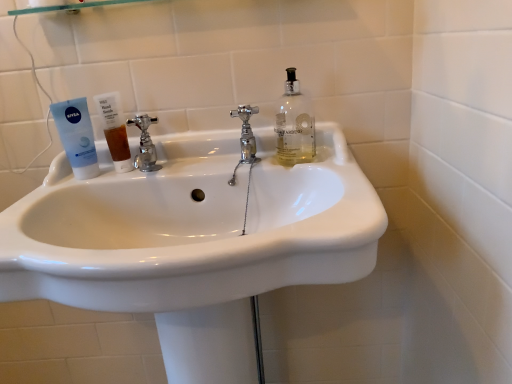
Measure the distance between point [80,239] and camera.

The distance of point [80,239] from camera is 30.91 inches.

Locate an element on the screen. The image size is (512, 384). polished chrome faucet at center, the 2th tap in the right-to-left sequence is located at coordinates (145, 144).

What do you see at coordinates (118, 143) in the screenshot?
I see `brown translucent liquid at sink left` at bounding box center [118, 143].

Locate an element on the screen. The height and width of the screenshot is (384, 512). brown translucent liquid at sink left is located at coordinates (118, 143).

What is the approximate width of polished chrome faucet at center, acting as the 2th tap starting from the left?

polished chrome faucet at center, acting as the 2th tap starting from the left, is 2.17 inches in width.

Locate an element on the screen. The width and height of the screenshot is (512, 384). blue matte tube at left is located at coordinates (77, 136).

Where is `white glossy sink at center`? This screenshot has height=384, width=512. white glossy sink at center is located at coordinates (194, 241).

How much distance is there between polished chrome faucet at center, the 2th tap in the right-to-left sequence, and blue matte tube at left?

polished chrome faucet at center, the 2th tap in the right-to-left sequence, is 10.37 centimeters from blue matte tube at left.

In the scene shown: From the image's perspective, is polished chrome faucet at center, the first tap from the left, over blue matte tube at left?

Yes, from the image's perspective, polished chrome faucet at center, the first tap from the left, is over blue matte tube at left.

Is the surface of polished chrome faucet at center, the first tap from the left, in direct contact with blue matte tube at left?

No, polished chrome faucet at center, the first tap from the left, is not making contact with blue matte tube at left.

Considering the sizes of objects polished chrome faucet at center, the 2th tap in the right-to-left sequence, and blue matte tube at left in the image provided, who is smaller, polished chrome faucet at center, the 2th tap in the right-to-left sequence, or blue matte tube at left?

With smaller size is polished chrome faucet at center, the 2th tap in the right-to-left sequence.

Does blue matte tube at left have a greater width compared to polished chrome faucet at center, arranged as the 1th tap when viewed from the right?

Indeed, blue matte tube at left has a greater width compared to polished chrome faucet at center, arranged as the 1th tap when viewed from the right.

Who is taller, blue matte tube at left or polished chrome faucet at center, acting as the 2th tap starting from the left?

blue matte tube at left.

From the image's perspective, who appears lower, blue matte tube at left or polished chrome faucet at center, acting as the 2th tap starting from the left?

blue matte tube at left.

Which is behind, point (88, 157) or point (249, 135)?

The point (249, 135) is more distant.

From the image's perspective, which one is positioned lower, polished chrome faucet at center, acting as the 2th tap starting from the left, or brown translucent liquid at sink left?

From the image's view, brown translucent liquid at sink left is below.

Does polished chrome faucet at center, acting as the 2th tap starting from the left, have a greater width compared to brown translucent liquid at sink left?

Yes.

Does polished chrome faucet at center, arranged as the 1th tap when viewed from the right, have a greater height compared to brown translucent liquid at sink left?

Yes, polished chrome faucet at center, arranged as the 1th tap when viewed from the right, is taller than brown translucent liquid at sink left.

Is point (129, 154) behind point (145, 170)?

Yes, it is.

Considering the positions of objects brown translucent liquid at sink left and polished chrome faucet at center, the 2th tap in the right-to-left sequence, in the image provided, who is behind, brown translucent liquid at sink left or polished chrome faucet at center, the 2th tap in the right-to-left sequence,?

Positioned behind is brown translucent liquid at sink left.

Considering the sizes of objects brown translucent liquid at sink left and polished chrome faucet at center, the 2th tap in the right-to-left sequence, in the image provided, who is taller, brown translucent liquid at sink left or polished chrome faucet at center, the 2th tap in the right-to-left sequence,?

With more height is polished chrome faucet at center, the 2th tap in the right-to-left sequence.

Is blue matte tube at left wider or thinner than polished chrome faucet at center, the 2th tap in the right-to-left sequence?

In the image, blue matte tube at left appears to be wider than polished chrome faucet at center, the 2th tap in the right-to-left sequence.

Is blue matte tube at left oriented away from polished chrome faucet at center, the 2th tap in the right-to-left sequence?

No, polished chrome faucet at center, the 2th tap in the right-to-left sequence, is not at the back of blue matte tube at left.

From a real-world perspective, which is physically below, blue matte tube at left or polished chrome faucet at center, the first tap from the left?

polished chrome faucet at center, the first tap from the left.

Is blue matte tube at left completely or partially inside brown translucent liquid at sink left?

Definitely not — blue matte tube at left is not inside brown translucent liquid at sink left.

Between brown translucent liquid at sink left and blue matte tube at left, which one has less height?

brown translucent liquid at sink left is shorter.

Between brown translucent liquid at sink left and blue matte tube at left, which one appears on the right side from the viewer's perspective?

brown translucent liquid at sink left is more to the right.

From a real-world perspective, relative to polished chrome faucet at center, the first tap from the left, is white glossy sink at center vertically above or below?

In terms of real-world spatial position, white glossy sink at center is below polished chrome faucet at center, the first tap from the left.

Is white glossy sink at center bigger than polished chrome faucet at center, the 2th tap in the right-to-left sequence?

Yes, white glossy sink at center is bigger than polished chrome faucet at center, the 2th tap in the right-to-left sequence.

Is white glossy sink at center not within polished chrome faucet at center, the first tap from the left?

Indeed, white glossy sink at center is completely outside polished chrome faucet at center, the first tap from the left.

What's the angular difference between white glossy sink at center and polished chrome faucet at center, the first tap from the left,'s facing directions?

7.39 degrees separate the facing orientations of white glossy sink at center and polished chrome faucet at center, the first tap from the left.

From a real-world perspective, count 1st taps downward from the blue matte tube at left and point to it. Please provide its 2D coordinates.

[(145, 144)]

Where is `toothpaste below the polished chrome faucet at center, arranged as the 1th tap when viewed from the right (from the image's perspective)`? This screenshot has height=384, width=512. toothpaste below the polished chrome faucet at center, arranged as the 1th tap when viewed from the right (from the image's perspective) is located at coordinates (77, 136).

Based on their spatial positions, is white glossy sink at center or blue matte tube at left further from polished chrome faucet at center, acting as the 2th tap starting from the left?

blue matte tube at left is positioned further to the anchor polished chrome faucet at center, acting as the 2th tap starting from the left.

From the image, which object appears to be farther from white glossy sink at center, blue matte tube at left or polished chrome faucet at center, acting as the 2th tap starting from the left?

Based on the image, blue matte tube at left appears to be further to white glossy sink at center.

Considering their positions, is polished chrome faucet at center, acting as the 2th tap starting from the left, positioned closer to blue matte tube at left than white glossy sink at center?

white glossy sink at center is positioned closer to the anchor blue matte tube at left.

When comparing their distances from white glossy sink at center, does brown translucent liquid at sink left or polished chrome faucet at center, the 2th tap in the right-to-left sequence, seem further?

Based on the image, brown translucent liquid at sink left appears to be further to white glossy sink at center.

Based on their spatial positions, is brown translucent liquid at sink left or white glossy sink at center closer to polished chrome faucet at center, acting as the 2th tap starting from the left?

Based on the image, brown translucent liquid at sink left appears to be nearer to polished chrome faucet at center, acting as the 2th tap starting from the left.

From the picture: Looking at the image, which one is located closer to white glossy sink at center, polished chrome faucet at center, the 2th tap in the right-to-left sequence, or brown translucent liquid at sink left?

Among the two, polished chrome faucet at center, the 2th tap in the right-to-left sequence, is located nearer to white glossy sink at center.

Which object lies nearer to the anchor point white glossy sink at center, polished chrome faucet at center, the 2th tap in the right-to-left sequence, or blue matte tube at left?

Among the two, polished chrome faucet at center, the 2th tap in the right-to-left sequence, is located nearer to white glossy sink at center.

From the image, which object appears to be farther from polished chrome faucet at center, the first tap from the left, brown translucent liquid at sink left or white glossy sink at center?

The object further to polished chrome faucet at center, the first tap from the left, is white glossy sink at center.

In order to click on liquid located between blue matte tube at left and polished chrome faucet at center, the 2th tap in the right-to-left sequence, in the left-right direction in this screenshot , I will do point(118,143).

Identify the location of tap between brown translucent liquid at sink left and polished chrome faucet at center, acting as the 2th tap starting from the left. (145, 144).

You are a GUI agent. You are given a task and a screenshot of the screen. Output one action in this format:
    pyautogui.click(x=<x>, y=<y>)
    Task: Click on the toothpaste that lies between polished chrome faucet at center, the 2th tap in the right-to-left sequence, and white glossy sink at center from top to bottom
    The height and width of the screenshot is (384, 512).
    Given the screenshot: What is the action you would take?
    pyautogui.click(x=77, y=136)

Identify the location of tap between polished chrome faucet at center, acting as the 2th tap starting from the left, and white glossy sink at center from top to bottom. (145, 144).